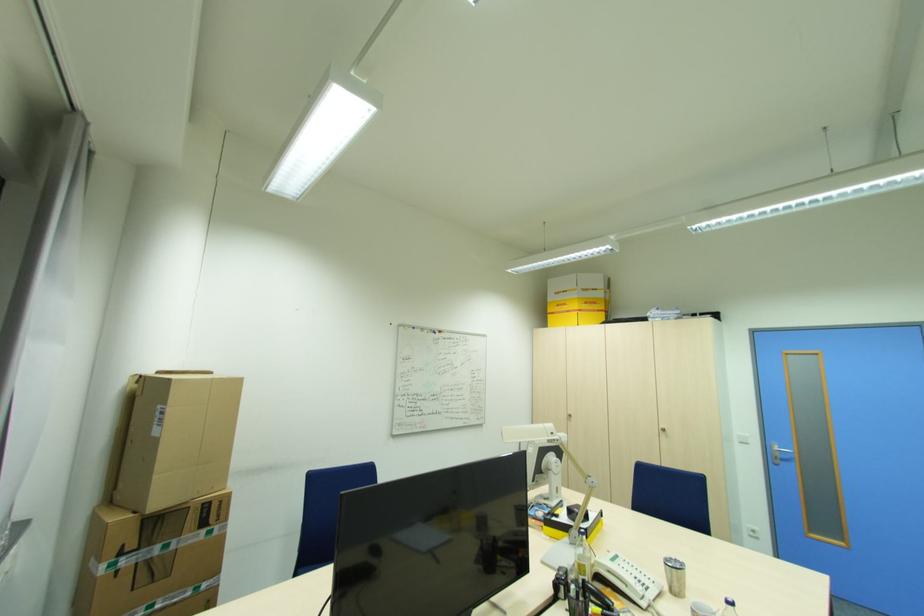
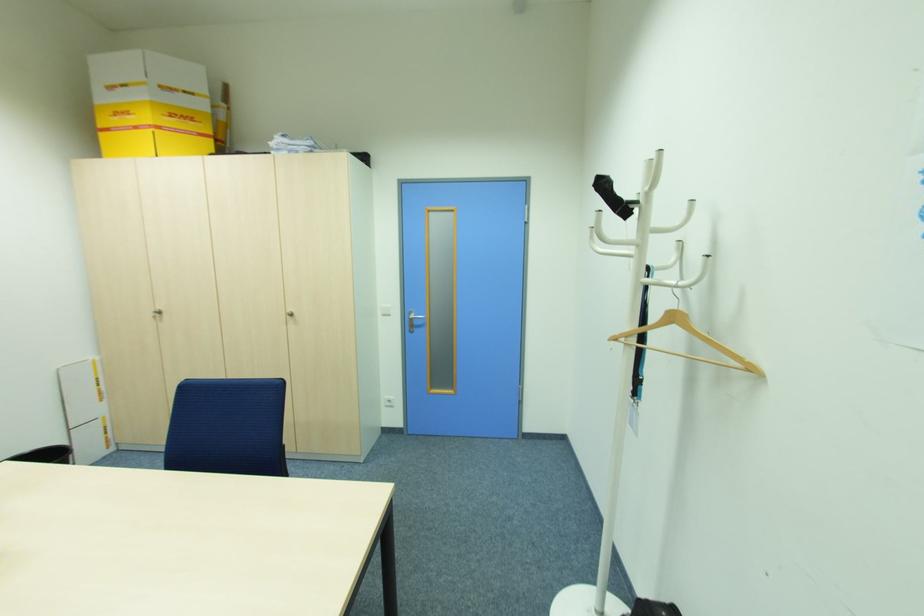
Where in the second image is the point corresponding to the point at 573,416 from the first image?

(162, 312)